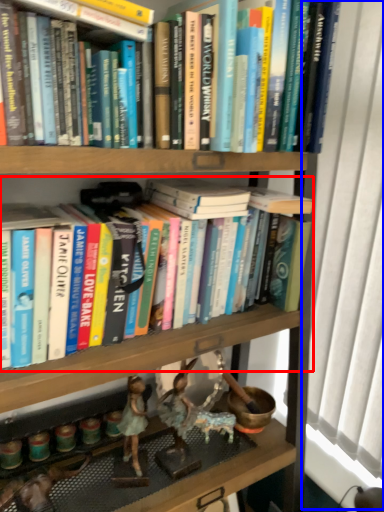
Question: Which object appears closest to the camera in this image, book (highlighted by a red box) or window screen (highlighted by a blue box)?

Choices:
 (A) book
 (B) window screen

Answer: (A)